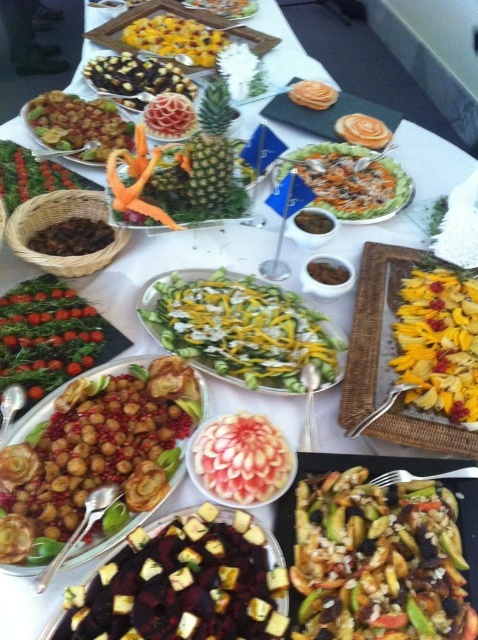
Consider the image. You are a guest at a buffet and want to take a photo of the green textured pineapple at center. Where should you position yourself relative to the table to capture it in the frame?

The green textured pineapple at center is located at point (209, 150), so you should position yourself near the center of the table to capture it in the frame.

You are standing at the buffet table and want to reach both points. Which point, point (x=217, y=528) or point (x=224, y=99), is closer to you?

Point (x=217, y=528) is closer to you because it is in front of point (x=224, y=99).